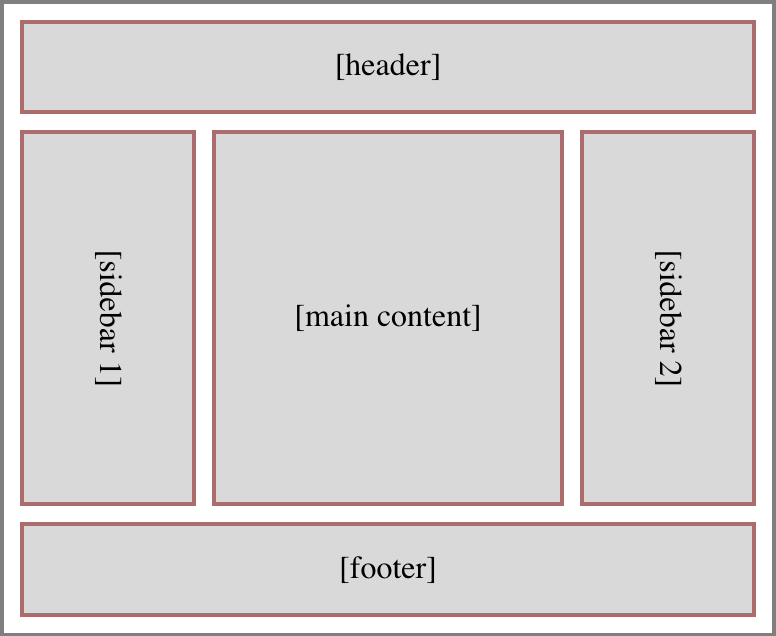
At what (x,y) coordinates should I click in order to perform the action: click on brackets. Please return your answer as a coordinate pair (x, y). This screenshot has width=776, height=636. Looking at the image, I should click on (113, 251), (108, 382), (296, 321), (476, 319), (344, 569), (432, 572), (670, 254), (662, 381), (335, 72), (435, 64).